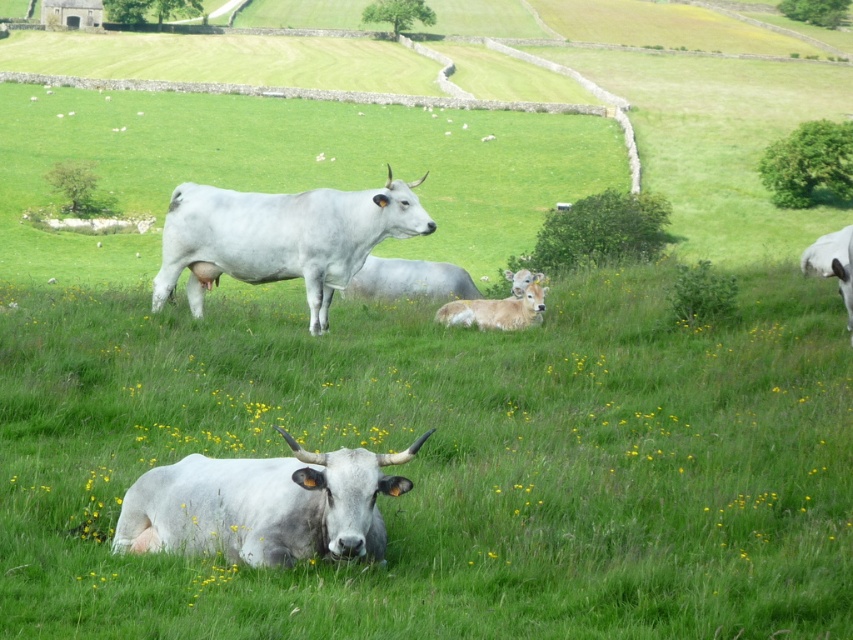
You are standing in the field and want to approach both the white smooth cow at lower center and the white smooth bull at right. Which animal should you approach first to reach the one closer to you?

You should approach the white smooth cow at lower center first because it is closer to you than the white smooth bull at right.

You are a farmer checking the field. You need to identify which animal is narrower between the white smooth cow at lower center and the white smooth bull at right. Which one is narrower?

The white smooth cow at lower center is narrower than the white smooth bull at right according to the description.

Based on the scene description, where is the white smooth bull at center located in terms of coordinates?

The white smooth bull at center is located at coordinates point (281, 237).